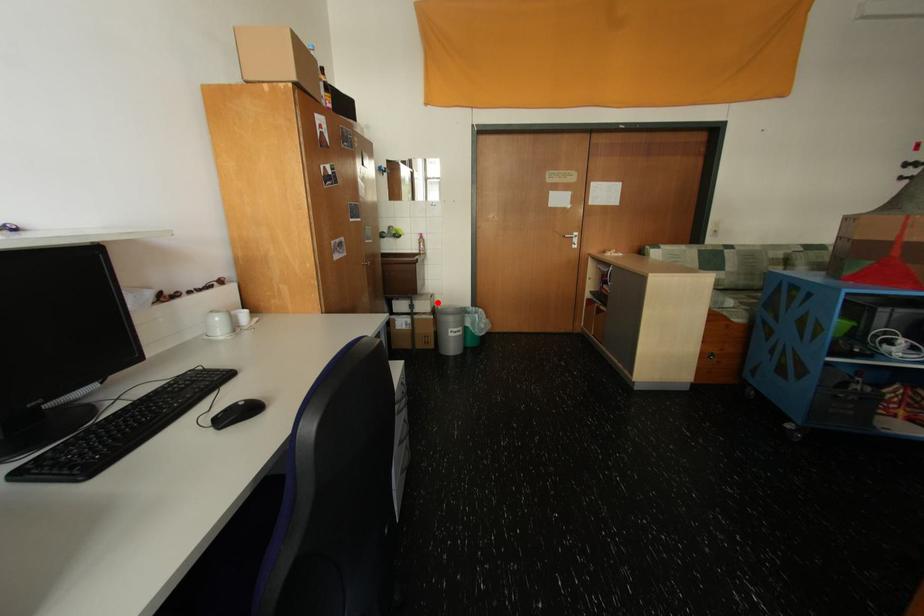
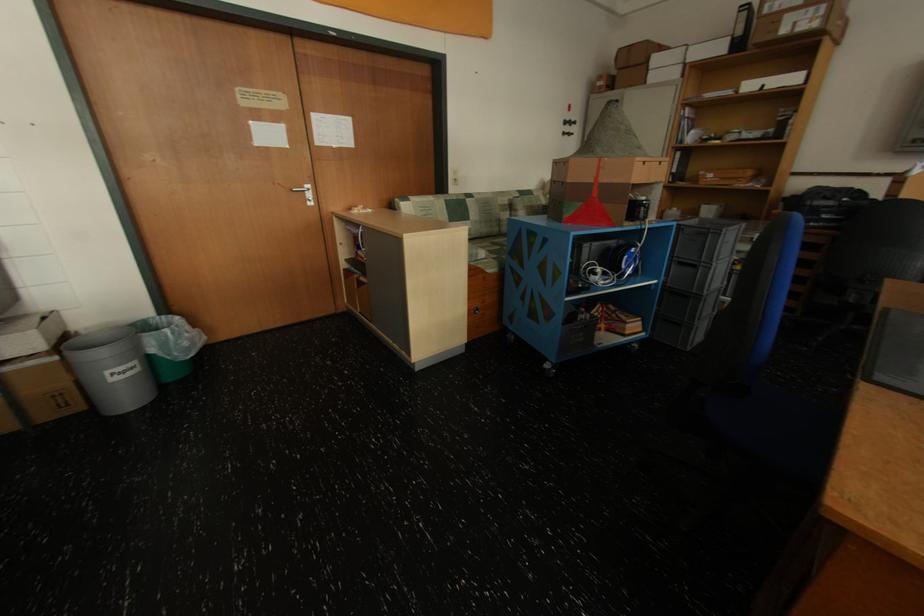
Question: I am providing you with two images of the same scene from different viewpoints. Image1 has a red point marked. In image2, the corresponding 3D location appears at what relative position? Reply with the corresponding letter.

Choices:
 (A) Closer
 (B) Farther

Answer: (B)